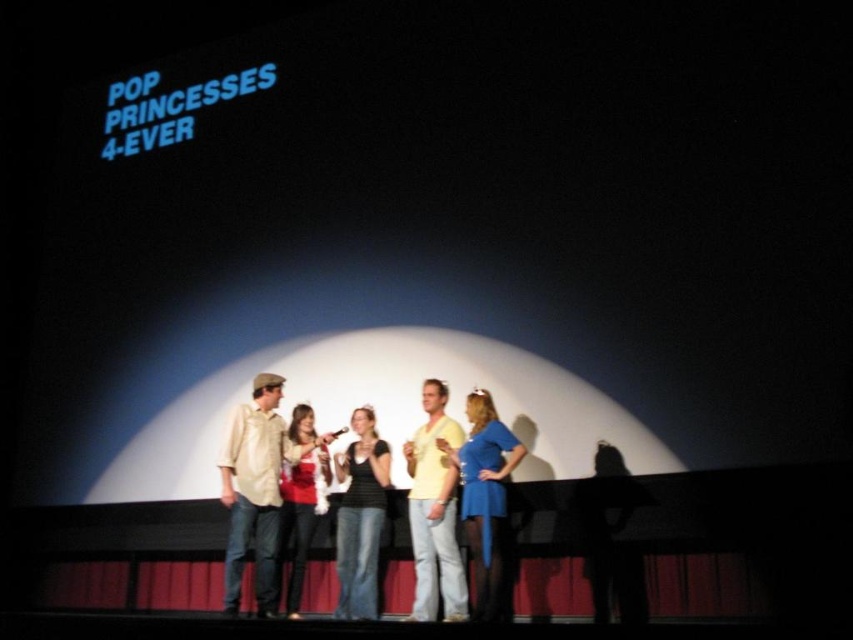
You are a stagehand who needs to place a prop on the stage. There are two points marked on the stage floor for placement. The first point is at coordinate point [624,579] and the second is at point [283,480]. Which point is closer to the audience if the audience is sitting in front of the stage?

Point [624,579] is in front of point [283,480], so placing the prop at point [624,579] would be closer to the audience since it is positioned closer to the front of the stage.

You are a photographer trying to capture a closeup of the light brown cotton shirt at center and the matte red dress at center. Can you fit both subjects into a single frame if your camera has a minimum focus distance of 30 centimeters?

The light brown cotton shirt at center and the matte red dress at center are 31.02 centimeters apart. Since the distance between them exceeds the camera lens minimum focus distance of 30 centimeters, you might need to step back or use a wider lens to ensure both subjects are in focus and within the frame.

You are a stagehand preparing to adjust the lighting for the performance. You need to ensure that the spotlight can reach both the matte blue dress at center and the silhouette dress at right. Considering their heights, which dress might require a higher spotlight position to fully illuminate?

The matte blue dress at center is much taller than the silhouette dress at right, so the spotlight might need to be positioned higher to fully illuminate the matte blue dress at center.